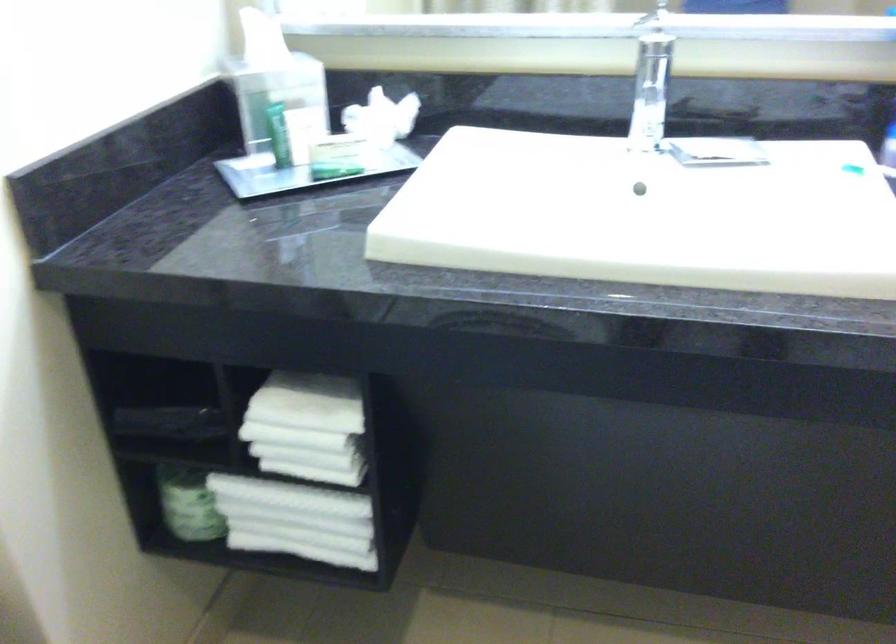
This screenshot has width=896, height=644. Describe the element at coordinates (188, 504) in the screenshot. I see `the green rolled item` at that location.